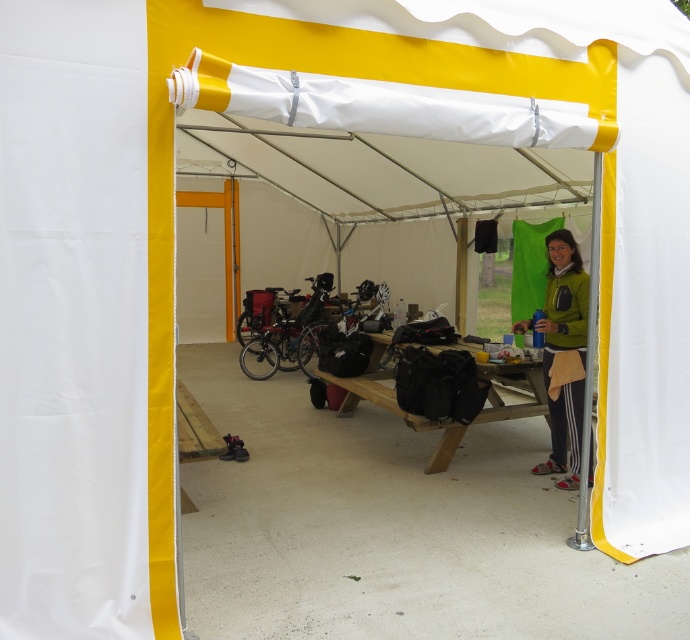
Question: Which point is closer to the camera taking this photo?

Choices:
 (A) (566, 337)
 (B) (406, 419)

Answer: (A)

Question: Among these objects, which one is nearest to the camera?

Choices:
 (A) wooden picnic table at center
 (B) green fleece jacket at center

Answer: (B)

Question: Does green fleece jacket at center lie in front of wooden picnic table at center?

Choices:
 (A) no
 (B) yes

Answer: (B)

Question: Is green fleece jacket at center positioned behind wooden picnic table at center?

Choices:
 (A) no
 (B) yes

Answer: (A)

Question: Does green fleece jacket at center appear over wooden picnic table at center?

Choices:
 (A) yes
 (B) no

Answer: (A)

Question: Which of the following is the farthest from the observer?

Choices:
 (A) (564, 410)
 (B) (477, 369)

Answer: (B)